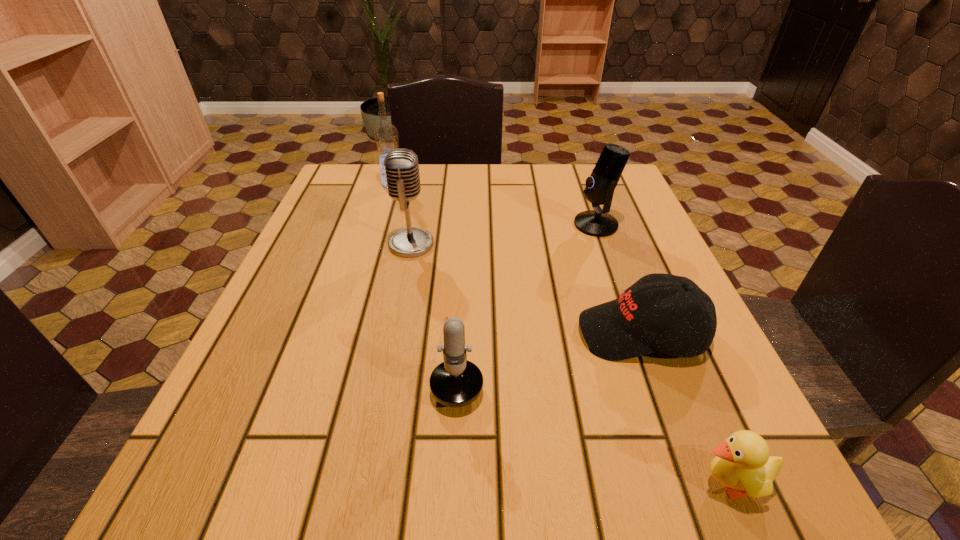
The width and height of the screenshot is (960, 540). Identify the location of vacant space at the far edge. (528, 207).

Where is `free point at the near edge`? This screenshot has width=960, height=540. free point at the near edge is located at coordinates (566, 472).

Find the location of a particular element. free spot at the left edge of the desktop is located at coordinates (295, 313).

Identify the location of vacant point at the right edge. The image size is (960, 540). (605, 253).

This screenshot has height=540, width=960. In the image, there is a desktop. What are the coordinates of `free space at the far left corner` in the screenshot? It's located at (371, 204).

I want to click on vacant area at the far right corner, so click(583, 167).

You are a GUI agent. You are given a task and a screenshot of the screen. Output one action in this format:
    pyautogui.click(x=<x>, y=<y>)
    Task: Click on the vacant space that's between the nearest object and the leftmost object
    The image size is (960, 540).
    Given the screenshot: What is the action you would take?
    pyautogui.click(x=561, y=333)

This screenshot has width=960, height=540. What are the coordinates of `free space that is in between the rightmost microphone and the second object from left to right` in the screenshot? It's located at (503, 234).

Identify the location of blank region between the leftmost microphone and the baseball cap. (526, 289).

What are the coordinates of `free area in between the shortest microphone and the baseball cap` in the screenshot? It's located at (550, 347).